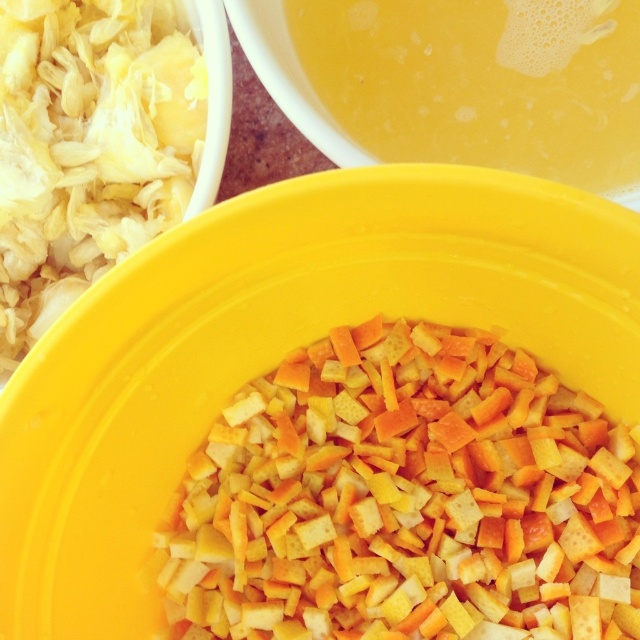
Question: Is yellow crumbly at center bigger than yellow liquid at upper center?

Choices:
 (A) no
 (B) yes

Answer: (B)

Question: Which object is the farthest from the white shredded cabbage at upper left?

Choices:
 (A) yellow crumbly at center
 (B) yellow liquid at upper center

Answer: (A)

Question: Does white shredded cabbage at upper left have a lesser width compared to yellow liquid at upper center?

Choices:
 (A) no
 (B) yes

Answer: (B)

Question: Which point is closer to the camera taking this photo?

Choices:
 (A) (554, 563)
 (B) (93, 250)

Answer: (A)

Question: Is yellow crumbly at center positioned behind yellow liquid at upper center?

Choices:
 (A) yes
 (B) no

Answer: (B)

Question: Based on their relative distances, which object is nearer to the white shredded cabbage at upper left?

Choices:
 (A) yellow crumbly at center
 (B) yellow liquid at upper center

Answer: (B)